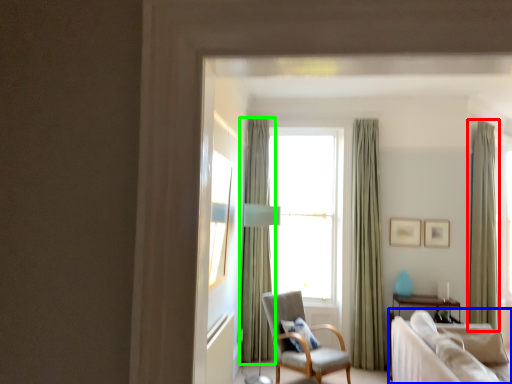
Question: Which is nearer to the curtain (highlighted by a red box)? studio couch (highlighted by a blue box) or curtain (highlighted by a green box).

Choices:
 (A) studio couch
 (B) curtain

Answer: (A)